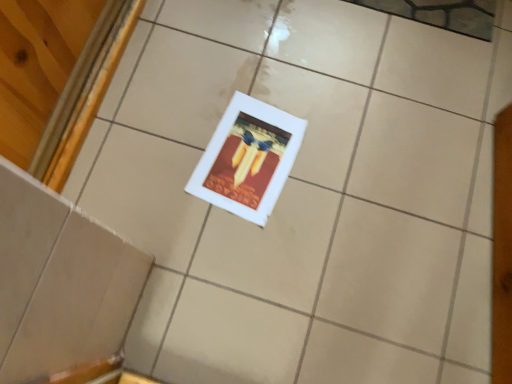
At what (x,y) coordinates should I click in order to perform the action: click on free space below white matte picture frame at center (from a real-world perspective). Please return your answer as a coordinate pair (x, y). Looking at the image, I should click on (252, 160).